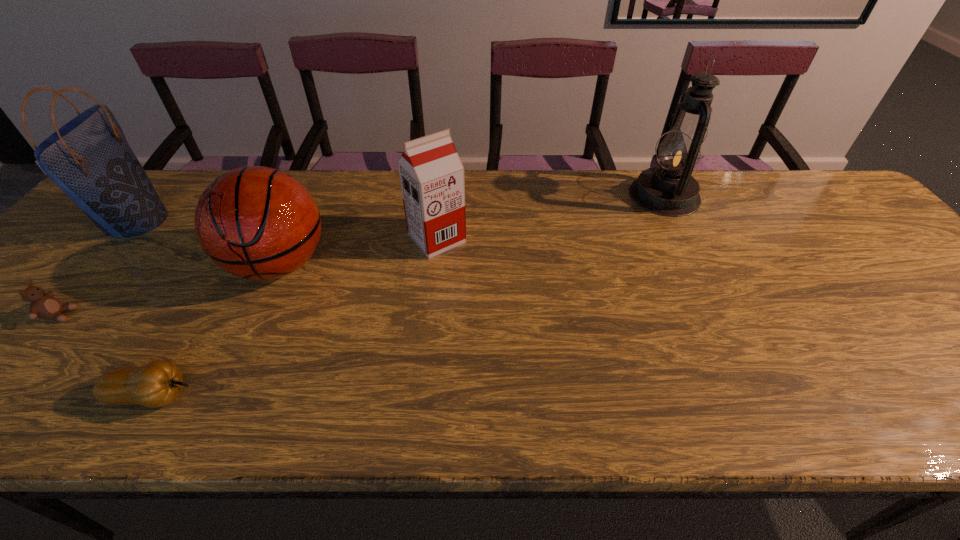
Identify the location of vacant space located on the front-facing side of the teddy bear. The image size is (960, 540). (167, 315).

You are a GUI agent. You are given a task and a screenshot of the screen. Output one action in this format:
    pyautogui.click(x=<x>, y=<y>)
    Task: Click on the free spot located on the stem side of the gourd
    Image resolution: width=960 pixels, height=540 pixels.
    Given the screenshot: What is the action you would take?
    pyautogui.click(x=390, y=396)

Identify the location of oil lamp positioned at the far edge. Image resolution: width=960 pixels, height=540 pixels. (669, 190).

Locate an element on the screen. shopping bag that is at the far edge is located at coordinates (89, 158).

Where is `object situated at the near edge`? object situated at the near edge is located at coordinates (158, 383).

The image size is (960, 540). Identify the location of shopping bag that is at the left edge. (89, 158).

At what (x,y) coordinates should I click in order to perform the action: click on teddy bear that is at the left edge. Please return your answer as a coordinate pair (x, y). The width and height of the screenshot is (960, 540). Looking at the image, I should click on (43, 305).

What are the coordinates of `object at the far left corner` in the screenshot? It's located at (x=89, y=158).

The width and height of the screenshot is (960, 540). I want to click on free point at the far edge, so (468, 199).

I want to click on free spot at the near edge of the desktop, so click(x=708, y=424).